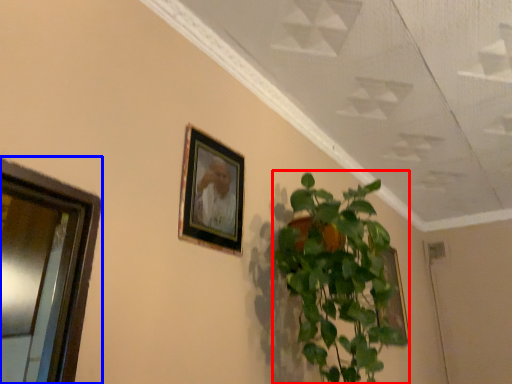
Question: Which object is further to the camera taking this photo, houseplant (highlighted by a red box) or window (highlighted by a blue box)?

Choices:
 (A) houseplant
 (B) window

Answer: (A)